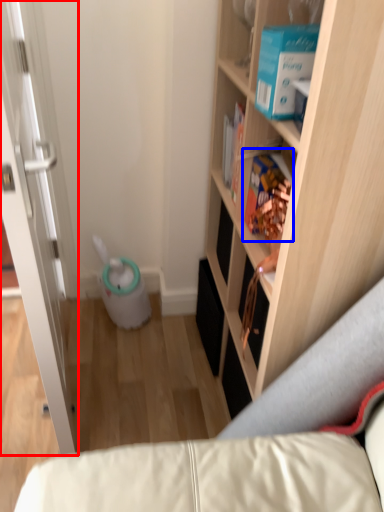
Question: Among these objects, which one is nearest to the camera, door (highlighted by a red box) or book (highlighted by a blue box)?

Choices:
 (A) door
 (B) book

Answer: (A)